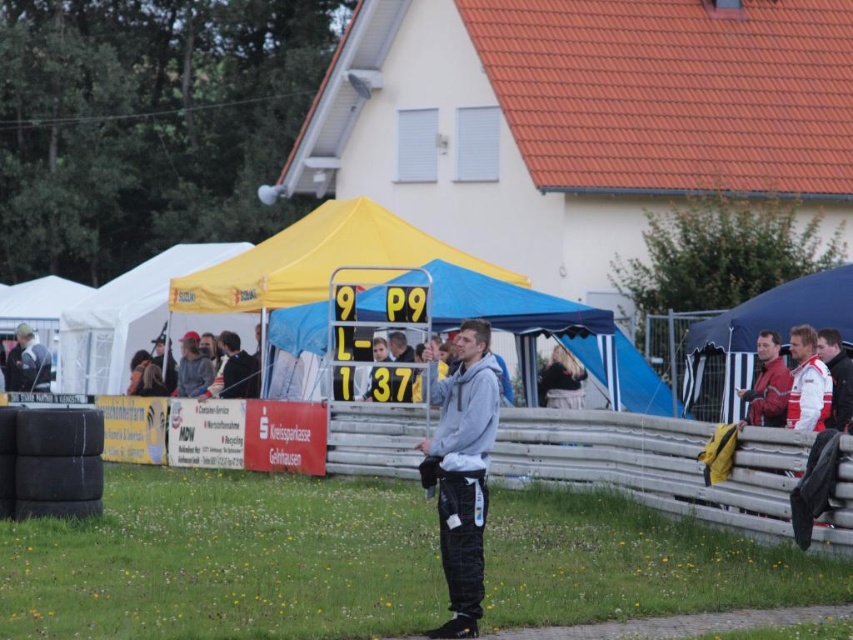
You are a photographer at a motorsport event. You need to capture a photo of both the gray fleece jacket at center and the red leather jacket at right. Since you want to ensure both jackets are clearly visible in the frame, which jacket might you need to zoom in closer to accommodate its size?

The gray fleece jacket at center is larger in size than the red leather jacket at right, so you should zoom in closer to ensure the larger gray fleece jacket at center fits well in the frame while still capturing the smaller red leather jacket at right.

You are a spectator at a motorsport event and want to find the blue fabric canopy at right. From your current position near the timing board, which direction should you look relative to the yellow fabric canopy at upper left?

The blue fabric canopy at right is behind the yellow fabric canopy at upper left, so you should look behind the yellow fabric canopy at upper left to find the blue fabric canopy at right.

Based on the photo, you are standing at the timing board area of a racetrack and see two points marked in the scene. The first point is at coordinate point (120, 330) and the second is at coordinate point (711, 346). Which point is closer to you?

Point (120, 330) is closer to you because it is further to the camera than point (711, 346).